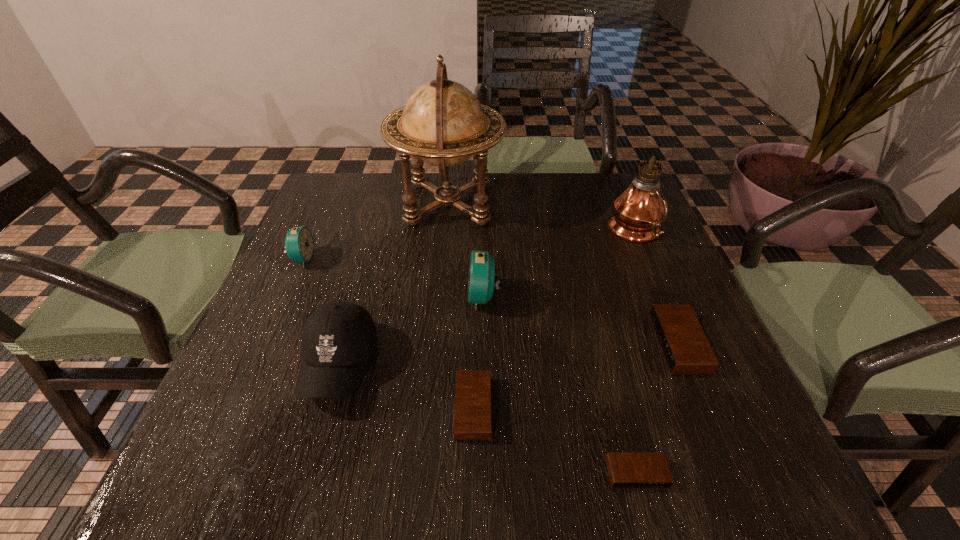
Find the location of a particular element. unoccupied area between the fourth shortest object and the oil lamp is located at coordinates (469, 246).

I want to click on free space that is in between the biggest black alarm clock and the baseball cap, so click(509, 354).

The image size is (960, 540). Find the location of `blank region between the baseball cap and the right blue alarm clock`. blank region between the baseball cap and the right blue alarm clock is located at coordinates (412, 330).

This screenshot has height=540, width=960. I want to click on vacant area that lies between the globe and the second shortest object, so click(x=461, y=305).

This screenshot has height=540, width=960. What are the coordinates of `vacant space that's between the globe and the leftmost black alarm clock` in the screenshot? It's located at (461, 305).

This screenshot has height=540, width=960. What are the coordinates of `vacant space that is in between the second nearest black alarm clock and the sixth object from left to right` in the screenshot? It's located at (555, 441).

This screenshot has height=540, width=960. Find the location of `vacant area that lies between the baseball cap and the second shortest object`. vacant area that lies between the baseball cap and the second shortest object is located at coordinates (406, 386).

I want to click on the second closest object relative to the globe, so click(x=299, y=244).

Identify which object is the sixth nearest to the right blue alarm clock. Please provide its 2D coordinates. Your answer should be formatted as a tuple, i.e. [(x, y)], where the tuple contains the x and y coordinates of a point satisfying the conditions above.

[(626, 470)]

Select which alarm clock is the second closest to the right blue alarm clock. Please provide its 2D coordinates. Your answer should be formatted as a tuple, i.e. [(x, y)], where the tuple contains the x and y coordinates of a point satisfying the conditions above.

[(686, 350)]